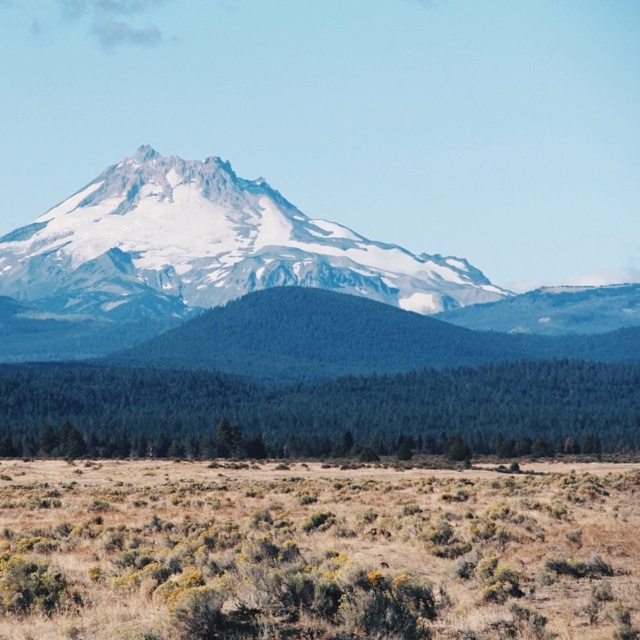
What do you see at coordinates (316, 552) in the screenshot? Image resolution: width=640 pixels, height=640 pixels. I see `dry shrubbery at lower left` at bounding box center [316, 552].

Is dry shrubbery at lower left wider than white snow-covered mountain at center?

In fact, dry shrubbery at lower left might be narrower than white snow-covered mountain at center.

Which is in front, point (433, 531) or point (177, 180)?

Point (433, 531)

Identify the location of dry shrubbery at lower left. The height and width of the screenshot is (640, 640). (316, 552).